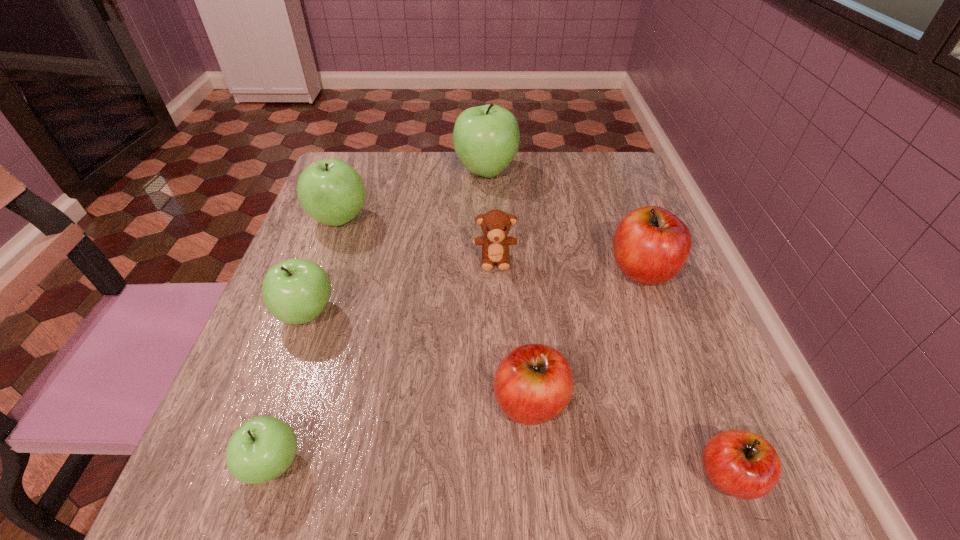
Identify which object is located as the fifth nearest to the nearest red apple. Please provide its 2D coordinates. Your answer should be formatted as a tuple, i.e. [(x, y)], where the tuple contains the x and y coordinates of a point satisfying the conditions above.

[(296, 291)]

Identify which apple is the third closest to the smallest green apple. Please provide its 2D coordinates. Your answer should be formatted as a tuple, i.e. [(x, y)], where the tuple contains the x and y coordinates of a point satisfying the conditions above.

[(330, 191)]

Identify which apple is the second closest to the farthest red apple. Please provide its 2D coordinates. Your answer should be formatted as a tuple, i.e. [(x, y)], where the tuple contains the x and y coordinates of a point satisfying the conditions above.

[(486, 138)]

Locate an element on the screen. the closest green apple relative to the biggest red apple is located at coordinates (486, 138).

At what (x,y) coordinates should I click in order to perform the action: click on green apple that is the closest to the second smallest green apple. Please return your answer as a coordinate pair (x, y). This screenshot has height=540, width=960. Looking at the image, I should click on (330, 191).

The width and height of the screenshot is (960, 540). Find the location of `red apple identified as the closest to the tallest object`. red apple identified as the closest to the tallest object is located at coordinates (651, 245).

At what (x,y) coordinates should I click in order to perform the action: click on red apple that is the closest to the brown teddy bear. Please return your answer as a coordinate pair (x, y). Looking at the image, I should click on coord(651,245).

Identify the location of blank space that satisfies the following two spatial constraints: 1. on the front side of the nearest red apple; 2. on the right side of the smallest green apple. This screenshot has width=960, height=540. (269, 476).

Locate an element on the screen. The width and height of the screenshot is (960, 540). free location that satisfies the following two spatial constraints: 1. on the face of the brown teddy bear; 2. on the right side of the leftmost red apple is located at coordinates (500, 402).

This screenshot has height=540, width=960. I want to click on vacant region that satisfies the following two spatial constraints: 1. on the front side of the second smallest red apple; 2. on the right side of the third biggest green apple, so click(275, 402).